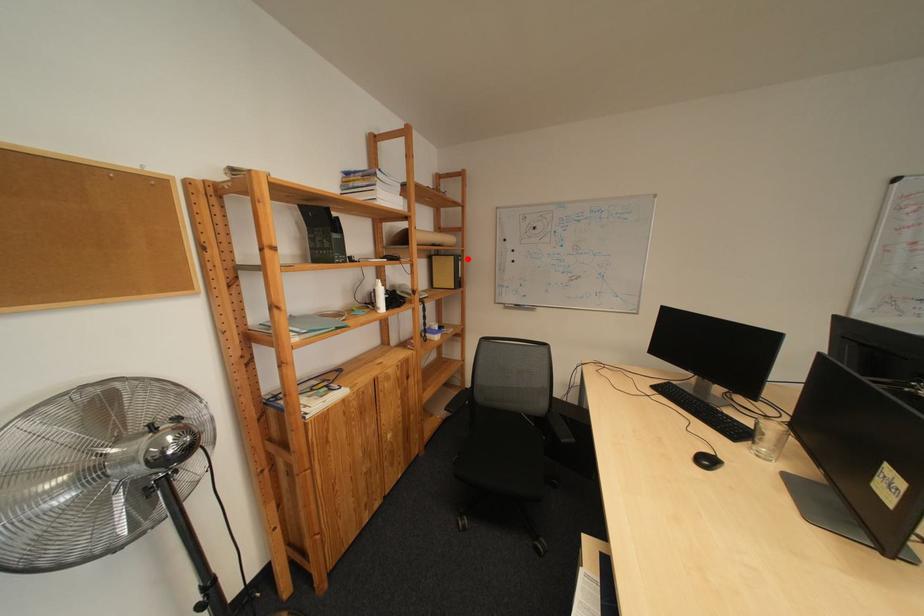
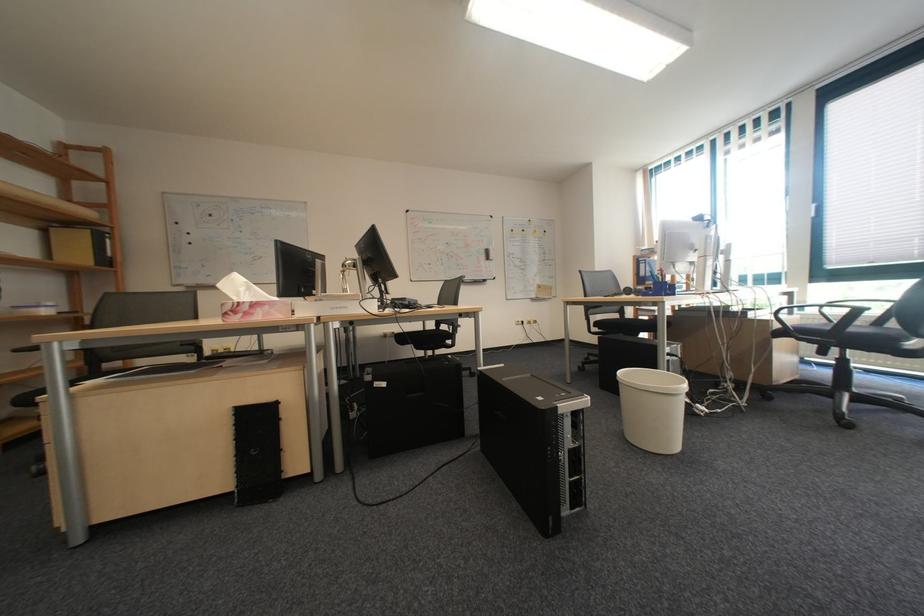
Question: I am providing you with two images of the same scene from different viewpoints. A red point is shown in image1. For the corresponding object point in image2, is it positioned nearer or farther from the camera?

Choices:
 (A) Nearer
 (B) Farther

Answer: (B)